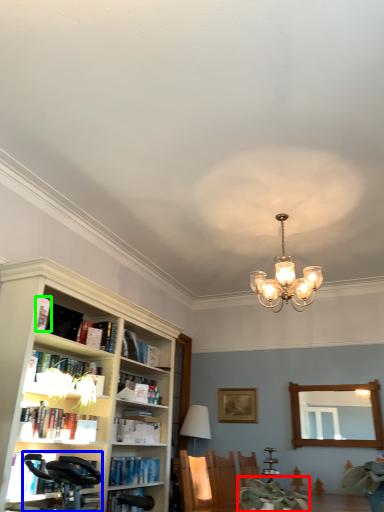
Question: Considering the real-world distances, which object is farthest from plant (highlighted by a red box)? swivel chair (highlighted by a blue box) or book (highlighted by a green box)?

Choices:
 (A) swivel chair
 (B) book

Answer: (B)